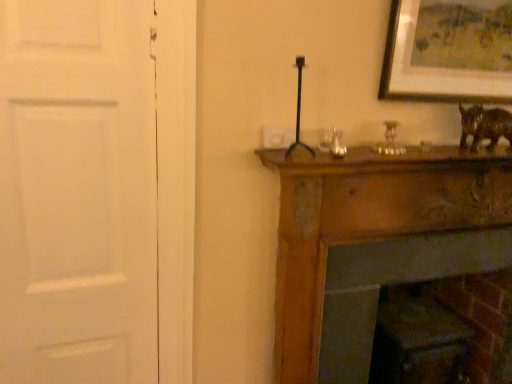
Question: Visually, is white plastic light switch at upper center positioned to the left or to the right of metallic gold candle holder at upper center?

Choices:
 (A) left
 (B) right

Answer: (A)

Question: From the image's perspective, relative to metallic gold candle holder at upper center, is white plastic light switch at upper center above or below?

Choices:
 (A) below
 (B) above

Answer: (A)

Question: Which object is the closest to the white matte door at left?

Choices:
 (A) wooden framed artwork at upper right
 (B) brick fireplace at lower right
 (C) metallic gold candle holder at upper center
 (D) brown glossy statue at upper right
 (E) white plastic light switch at upper center

Answer: (E)

Question: Based on their relative distances, which object is farther from the brown glossy statue at upper right?

Choices:
 (A) white matte door at left
 (B) metallic gold candle holder at upper center
 (C) brick fireplace at lower right
 (D) wooden framed artwork at upper right
 (E) white plastic light switch at upper center

Answer: (A)